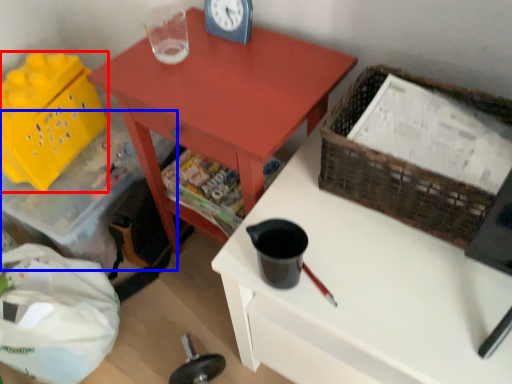
Question: Which object is further to the camera taking this photo, basket (highlighted by a red box) or storage box (highlighted by a blue box)?

Choices:
 (A) basket
 (B) storage box

Answer: (B)